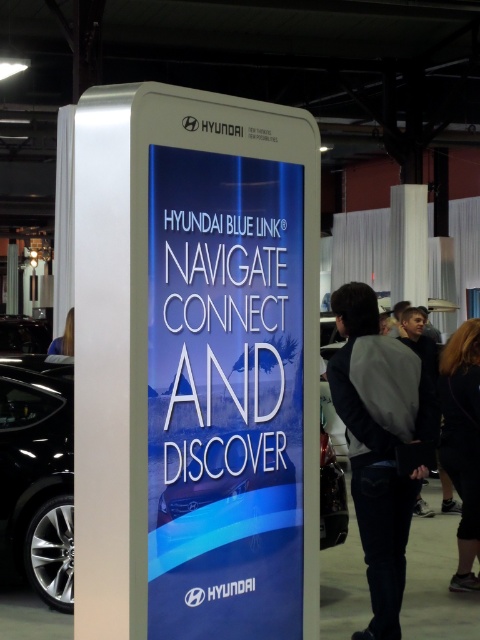
What is located at the coordinates point (194, 365) in the image?

The white glossy sign at center is located at point (194, 365).

You are standing in an auto show and want to read the text on the white glossy sign at center. The minimum distance required to read the text clearly is 3 meters. Can you read the text clearly from where you are standing?

The distance between you and the white glossy sign at center is 3.12 meters, which is slightly more than the minimum required 3 meters. Therefore, you can read the text clearly from your current position.

You are at an auto show and want to read the text on the white glossy sign at center. There is a gray fleece jacket at center in the way. Can you see the sign clearly?

The white glossy sign at center is closer to the viewer than the gray fleece jacket at center, so the jacket is blocking the view of the sign.